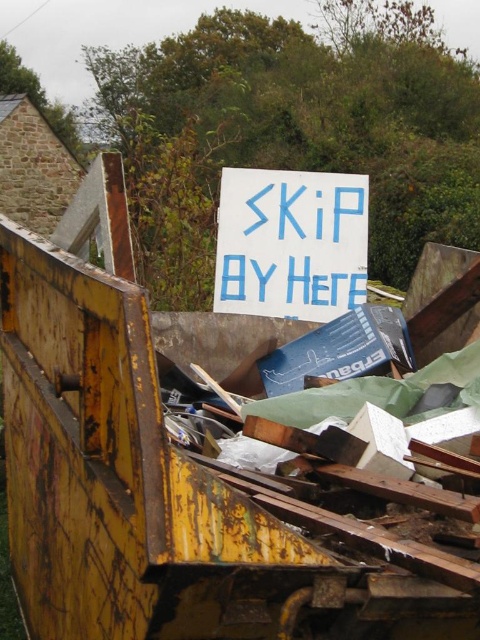
You are standing at the point closest to the skip. Which of the two points, point (352, 580) or point (265, 305), is closer to you?

Point (352, 580) is in front of point (265, 305), so it is closer to you.

You are standing in front of a skip with a blue sign on top. You see a rusty metal garbage truck at center and a white paper sign at center. Which object is positioned to the left of the other?

The rusty metal garbage truck at center is to the left of the white paper sign at center.